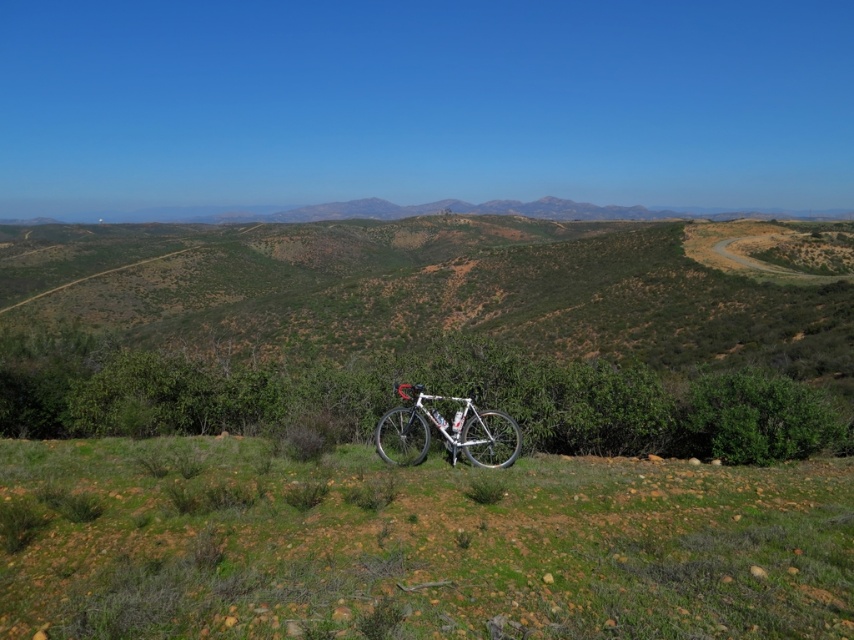
Question: Does green grassy at lower center have a lesser width compared to white metallic bicycle at center?

Choices:
 (A) no
 (B) yes

Answer: (A)

Question: Among these objects, which one is farthest from the camera?

Choices:
 (A) white metallic bicycle at center
 (B) green grassy at lower center

Answer: (A)

Question: Does green grassy at lower center appear over white metallic bicycle at center?

Choices:
 (A) no
 (B) yes

Answer: (A)

Question: Considering the relative positions of green grassy at lower center and white metallic bicycle at center in the image provided, where is green grassy at lower center located with respect to white metallic bicycle at center?

Choices:
 (A) right
 (B) left

Answer: (B)